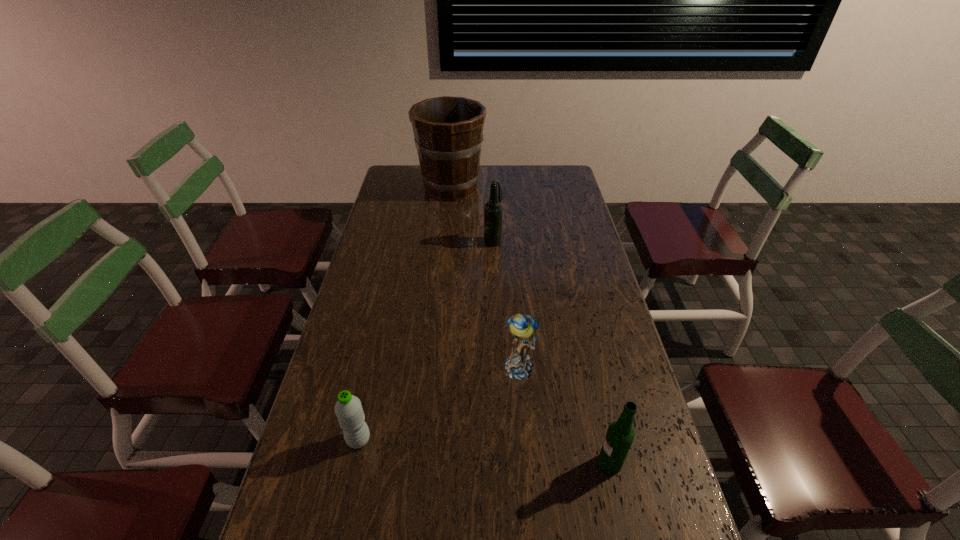
Identify the location of empty location between the shortest object and the second farthest object. (426, 340).

Find the location of a particular element. This screenshot has width=960, height=540. free point between the second nearest object and the parrot is located at coordinates (439, 403).

Identify the location of object that is the fourth closest to the third farthest object. (448, 131).

Point out which object is positioned as the second nearest to the parrot. Please provide its 2D coordinates. Your answer should be formatted as a tuple, i.e. [(x, y)], where the tuple contains the x and y coordinates of a point satisfying the conditions above.

[(348, 409)]

Find the location of a particular element. The width and height of the screenshot is (960, 540). free location that satisfies the following two spatial constraints: 1. on the back side of the shortest object; 2. on the right side of the second farthest object is located at coordinates (403, 241).

You are a GUI agent. You are given a task and a screenshot of the screen. Output one action in this format:
    pyautogui.click(x=<x>, y=<y>)
    Task: Click on the free space that satisfies the following two spatial constraints: 1. on the back side of the second nearest object; 2. on the left side of the farther beer bottle
    This screenshot has height=540, width=960.
    Given the screenshot: What is the action you would take?
    pyautogui.click(x=403, y=241)